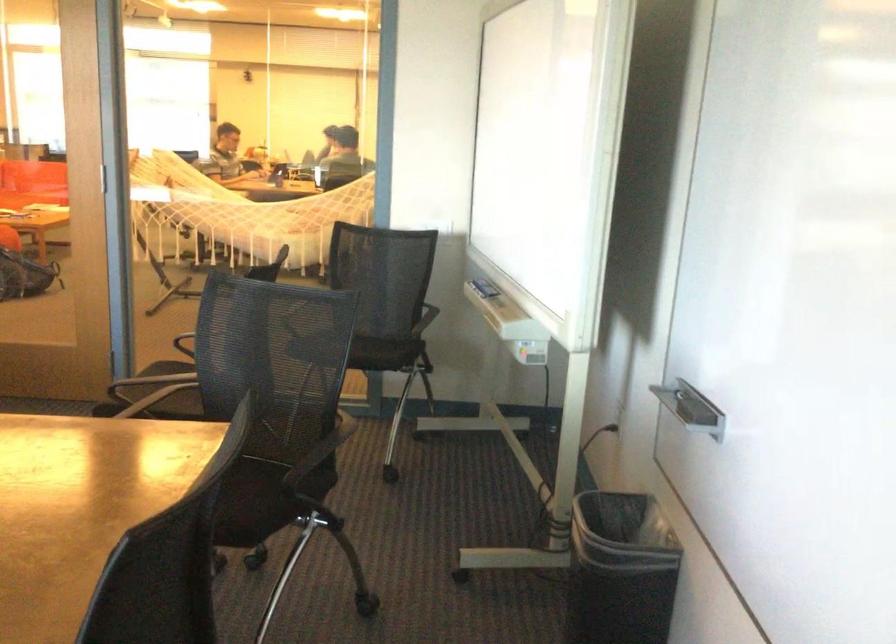
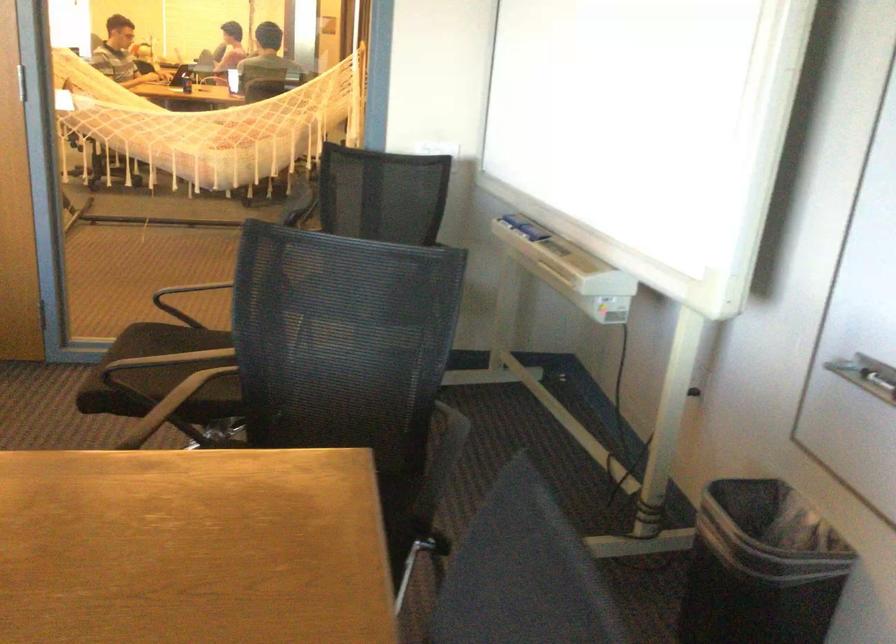
Question: The first image is from the beginning of the video and the second image is from the end. How did the camera likely rotate when shooting the video?

Choices:
 (A) Left
 (B) Right
 (C) Up
 (D) Down

Answer: (B)